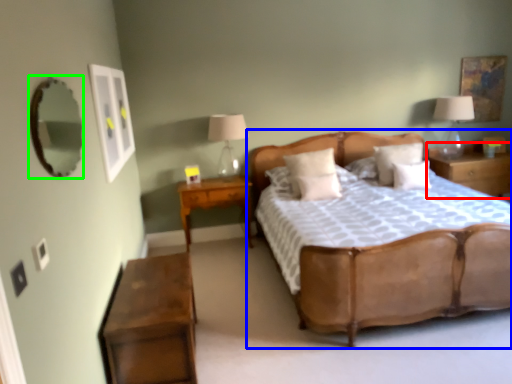
Question: Based on their relative distances, which object is farther from nightstand (highlighted by a red box)? Choose from bed (highlighted by a blue box) and mirror (highlighted by a green box).

Choices:
 (A) bed
 (B) mirror

Answer: (B)